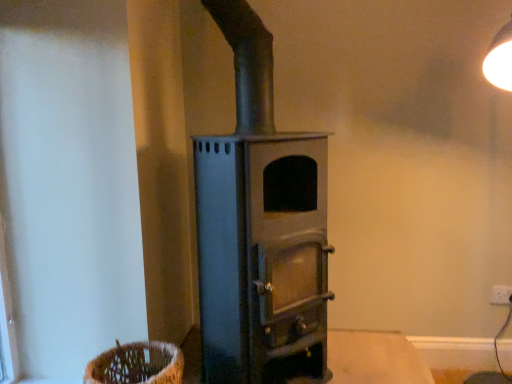
Question: Would you say white plastic electric outlet at lower right is to the left or to the right of woven brown basket at lower left in the picture?

Choices:
 (A) right
 (B) left

Answer: (A)

Question: Is white plastic electric outlet at lower right spatially inside woven brown basket at lower left, or outside of it?

Choices:
 (A) outside
 (B) inside

Answer: (A)

Question: Based on their relative distances, which object is farther from the matte gray wood burning stove at center?

Choices:
 (A) smooth wooden table at center
 (B) woven brown basket at lower left
 (C) white plastic electric outlet at lower right

Answer: (C)

Question: Estimate the real-world distances between objects in this image. Which object is closer to the matte gray wood burning stove at center?

Choices:
 (A) smooth wooden table at center
 (B) white plastic electric outlet at lower right
 (C) woven brown basket at lower left

Answer: (C)